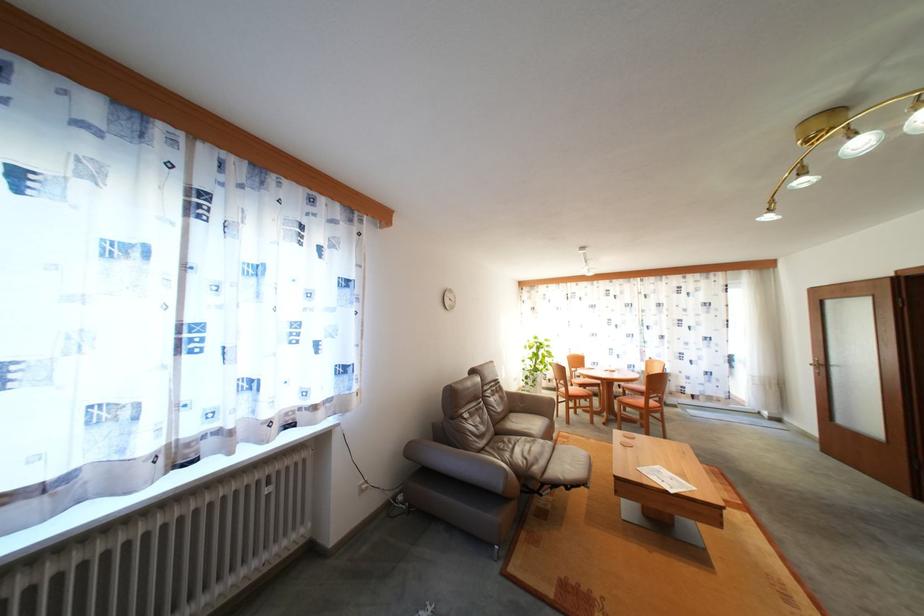
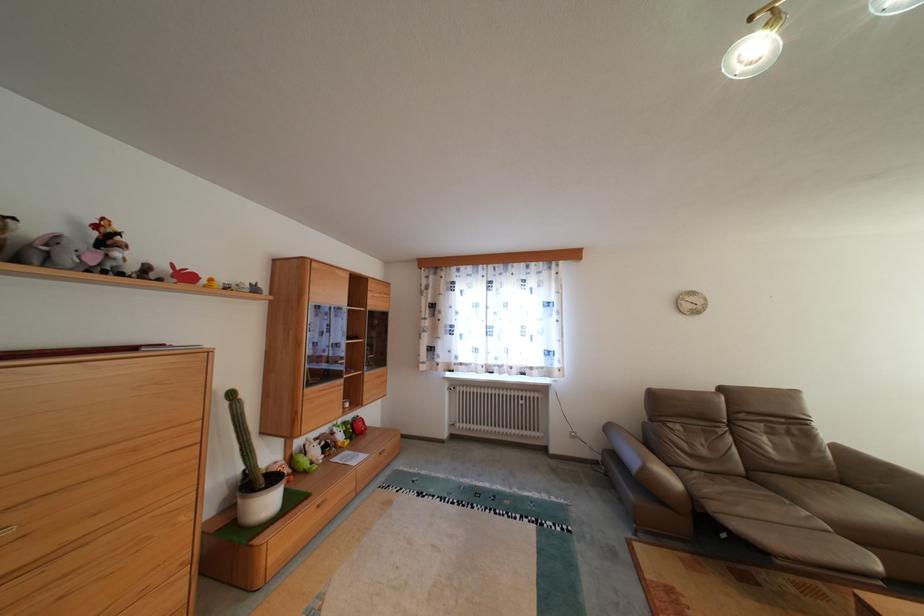
The point at (x=456, y=299) is marked in the first image. Where is the corresponding point in the second image?

(699, 302)